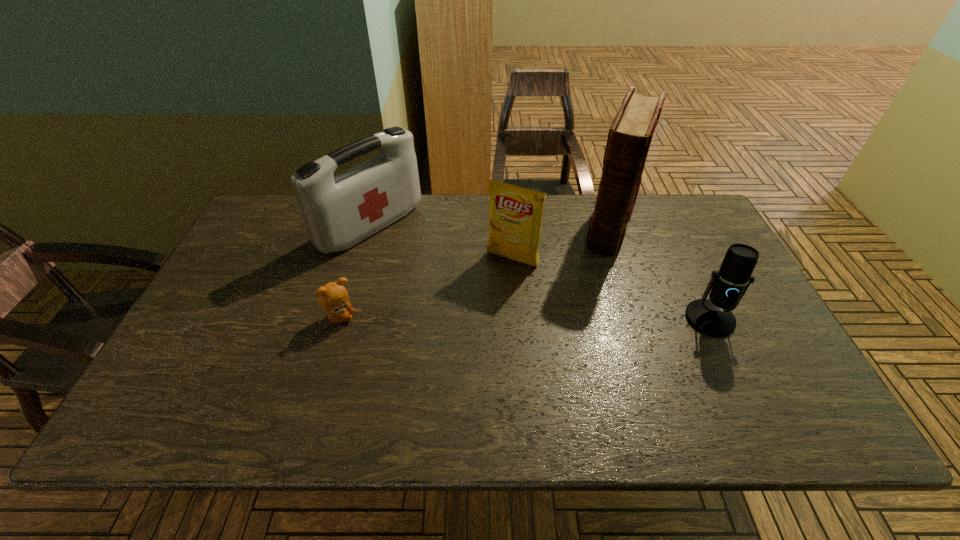
This screenshot has width=960, height=540. I want to click on free spot at the far edge of the desktop, so click(468, 220).

The image size is (960, 540). In order to click on free space at the near edge in this screenshot , I will do `click(607, 387)`.

What are the coordinates of `vacant space at the right edge of the desktop` in the screenshot? It's located at (707, 278).

Identify the location of vacant space at the far left corner of the desktop. This screenshot has width=960, height=540. (278, 200).

In the image, there is a desktop. Identify the location of blank space at the far right corner. The image size is (960, 540). (699, 210).

Where is `unoccupied position between the crisp (potato chip) and the microphone`? unoccupied position between the crisp (potato chip) and the microphone is located at coordinates (611, 289).

Locate an element on the screen. This screenshot has width=960, height=540. empty location between the tallest object and the microphone is located at coordinates (660, 271).

What are the coordinates of `free space between the first-aid kit and the shortest object` in the screenshot? It's located at (355, 272).

Where is `free space between the fourth object from left to right and the third object from right to left`? Image resolution: width=960 pixels, height=540 pixels. free space between the fourth object from left to right and the third object from right to left is located at coordinates (562, 242).

Find the location of a particular element. The image size is (960, 540). vacant space in between the teddy bear and the fourth object from left to right is located at coordinates (475, 271).